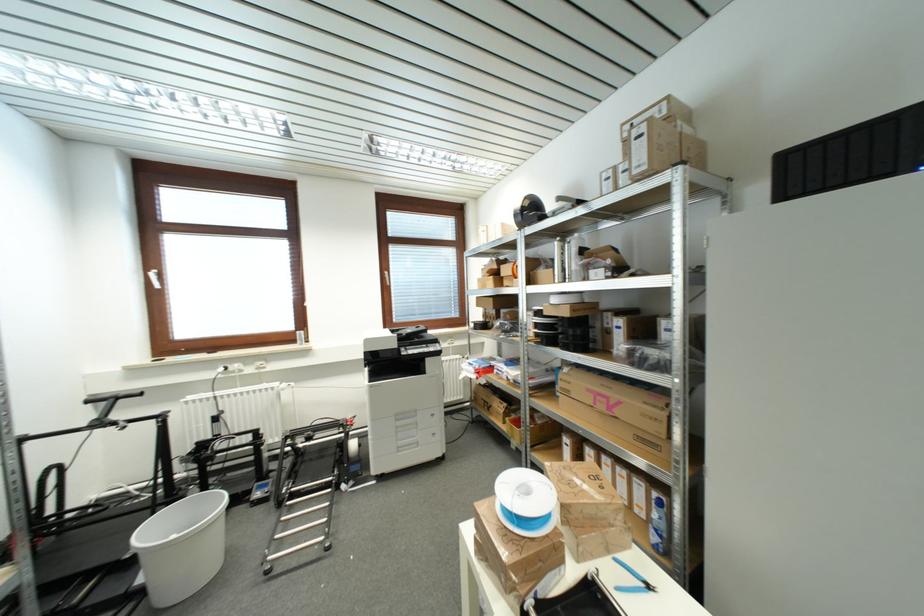
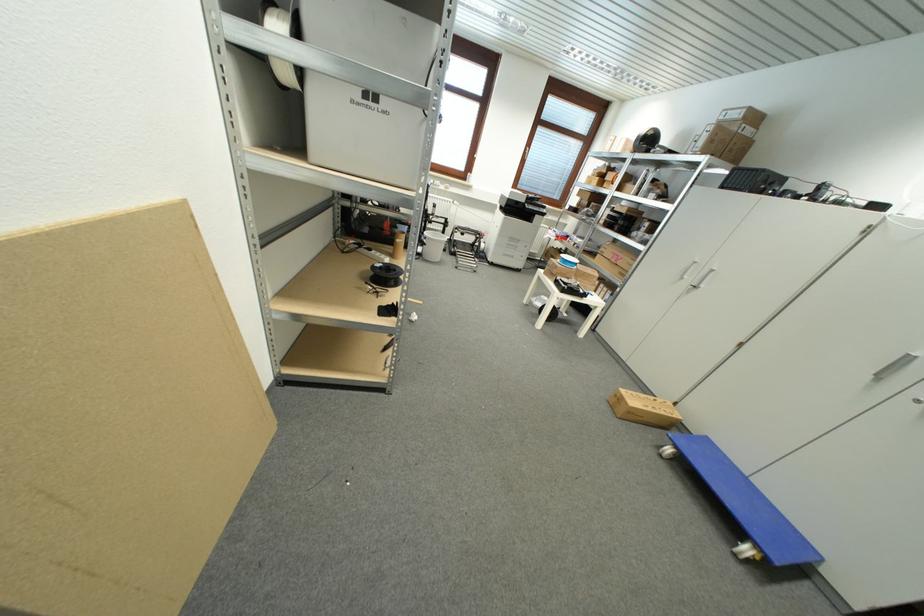
The point at (327, 452) is marked in the first image. Where is the corresponding point in the second image?

(468, 246)